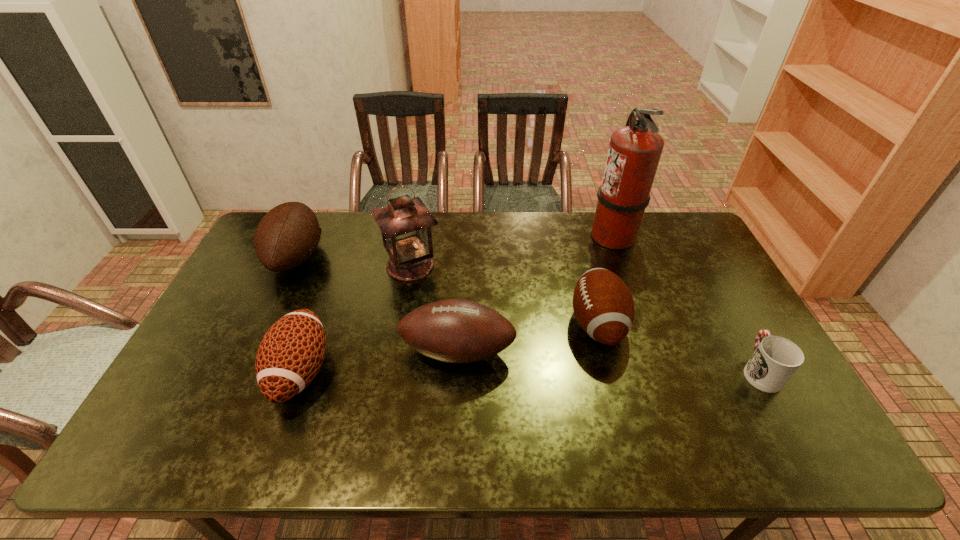
This screenshot has width=960, height=540. What are the coordinates of `object that is positioned at the left edge` in the screenshot? It's located at (287, 235).

Find the location of `object located at the right edge`. object located at the right edge is located at coordinates (775, 359).

The width and height of the screenshot is (960, 540). In order to click on object that is at the far left corner in this screenshot , I will do `click(287, 235)`.

The width and height of the screenshot is (960, 540). Identify the location of vacant position at the far edge of the desktop. (366, 235).

In the image, there is a desktop. At what (x,y) coordinates should I click in order to perform the action: click on vacant space at the near edge. Please return your answer as a coordinate pair (x, y). Looking at the image, I should click on (537, 433).

In the image, there is a desktop. What are the coordinates of `vacant space at the left edge` in the screenshot? It's located at (221, 389).

Locate an element on the screen. The height and width of the screenshot is (540, 960). vacant area at the far right corner is located at coordinates (677, 247).

What are the coordinates of `unoccupied position between the second football from right to left and the cup` in the screenshot? It's located at (x=609, y=361).

I want to click on free area in between the shortest object and the fire extinguisher, so click(x=686, y=303).

You are a GUI agent. You are given a task and a screenshot of the screen. Output one action in this format:
    pyautogui.click(x=<x>, y=<y>)
    Task: Click on the empty space that is in between the shortest object and the tallest object
    This screenshot has height=540, width=960.
    Given the screenshot: What is the action you would take?
    pyautogui.click(x=686, y=303)